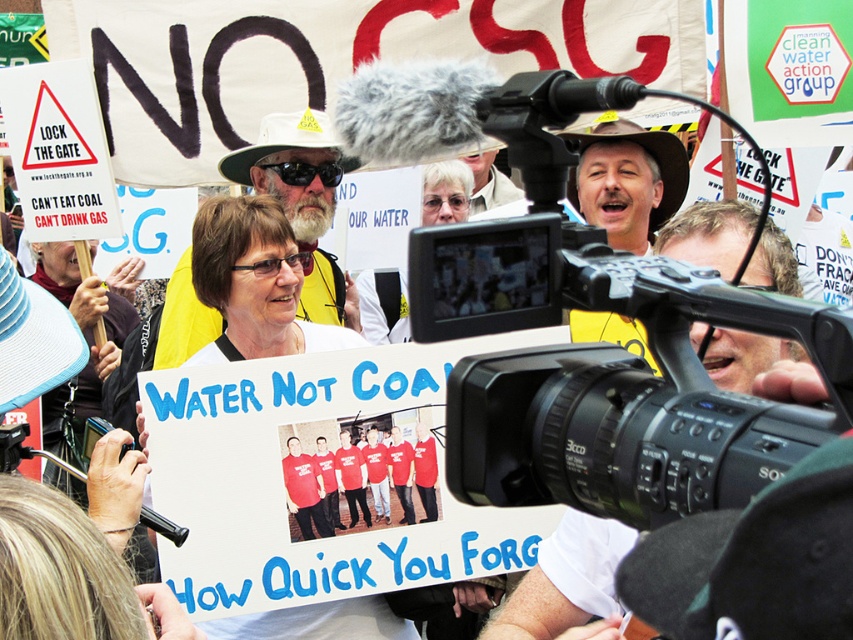
You are a journalist documenting the protest. You need to take a photo that clearly shows both the white paper sign at center and the matte white sign at center. Which sign should you focus on to ensure both are visible in the frame?

The white paper sign at center is bigger than the matte white sign at center, so focusing on the white paper sign at center will ensure both signs are visible in the frame.

You are a photographer trying to capture the protest scene. You notice two points marked in the image at coordinates point [257,332] and point [434,202]. Which point is closer to the camera?

Point [257,332] is in front of point [434,202], so it is closer to the camera.